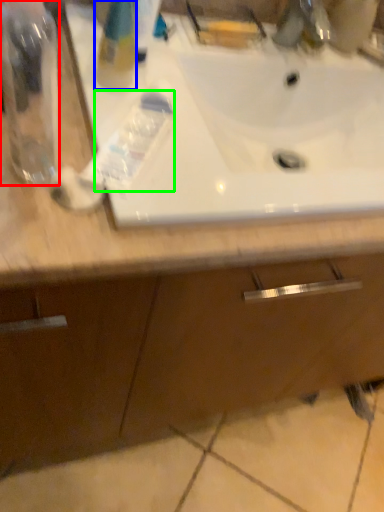
Question: Based on their relative distances, which object is farther from bottle (highlighted by a red box)? Choose from cleaning product (highlighted by a blue box) and toothpaste (highlighted by a green box).

Choices:
 (A) cleaning product
 (B) toothpaste

Answer: (A)